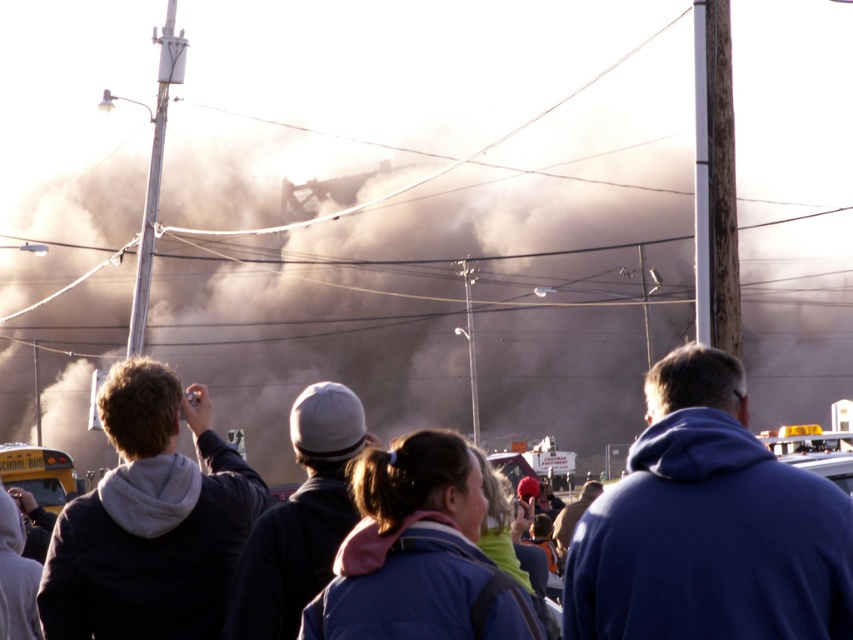
Question: Which point is farther to the camera?

Choices:
 (A) blue fleece jackets at center
 (B) gray knit cap at center

Answer: (B)

Question: Is blue fleece jackets at center thinner than gray knit cap at center?

Choices:
 (A) yes
 (B) no

Answer: (B)

Question: Is blue fleece jacket at center closer to camera compared to blue fleece jackets at center?

Choices:
 (A) yes
 (B) no

Answer: (A)

Question: Does blue fleece jacket at center lie behind yellow painted school bus at lower left?

Choices:
 (A) no
 (B) yes

Answer: (A)

Question: Which point is closer to the camera?

Choices:
 (A) (523, 614)
 (B) (296, 620)
 (C) (792, 582)

Answer: (C)

Question: Among these objects, which one is nearest to the camera?

Choices:
 (A) blue fleece jackets at center
 (B) blue fleece jacket at center
 (C) dark gray hoodie at center

Answer: (B)